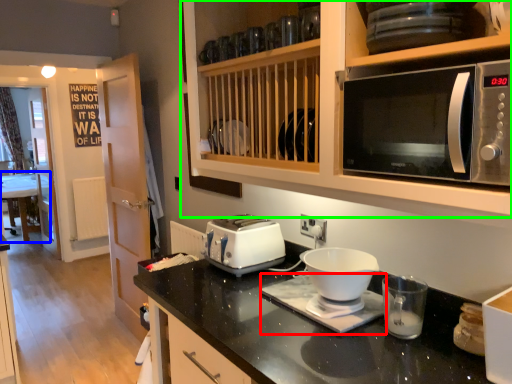
Question: Which object is the closest to the appliance (highlighted by a red box)? Choose among these: table (highlighted by a blue box) or cabinetry (highlighted by a green box).

Choices:
 (A) table
 (B) cabinetry

Answer: (B)